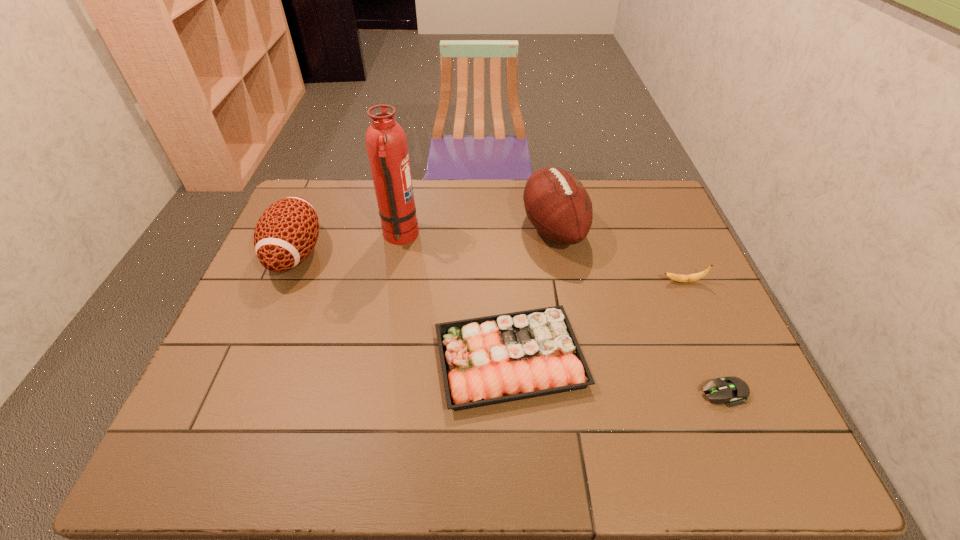
At what (x,y) coordinates should I click in order to perform the action: click on fire extinguisher. Please return your answer as a coordinate pair (x, y). This screenshot has height=540, width=960. Looking at the image, I should click on (386, 142).

Image resolution: width=960 pixels, height=540 pixels. Identify the location of the fifth object from right to left. (x=386, y=142).

The width and height of the screenshot is (960, 540). In order to click on the taller football in this screenshot , I will do `click(557, 204)`.

Locate an element on the screen. The height and width of the screenshot is (540, 960). the right football is located at coordinates (557, 204).

This screenshot has width=960, height=540. What are the coordinates of `the third tallest object` in the screenshot? It's located at (286, 233).

This screenshot has height=540, width=960. What are the coordinates of `the left football` in the screenshot? It's located at [286, 233].

Identify the location of banana. The height and width of the screenshot is (540, 960). (696, 276).

This screenshot has width=960, height=540. I want to click on the fifth tallest object, so [488, 360].

The height and width of the screenshot is (540, 960). Identify the location of computer mouse. (733, 390).

Locate an element on the screen. This screenshot has width=960, height=540. free region located 0.330m on the label side of the fire extinguisher is located at coordinates (523, 237).